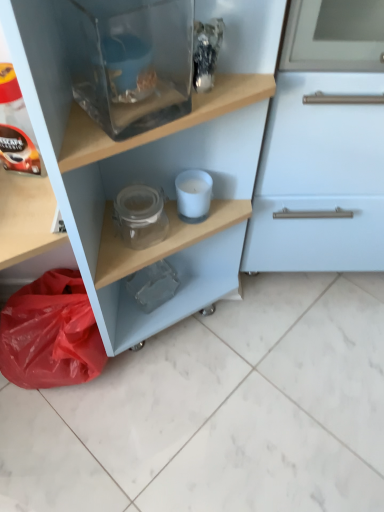
At what (x,y) coordinates should I click in order to perform the action: click on vacant area located to the right-hand side of transparent glass jar at upper center. Please return your answer as a coordinate pair (x, y). The width and height of the screenshot is (384, 512). Looking at the image, I should click on (296, 373).